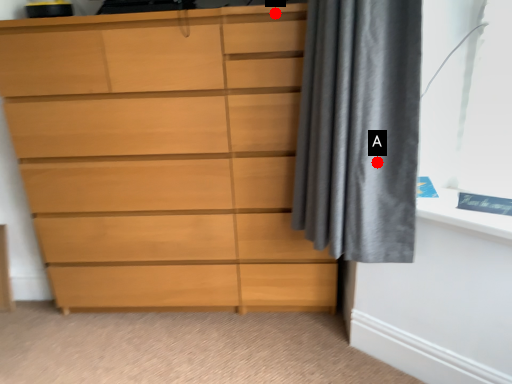
Question: Two points are circled on the image, labeled by A and B beside each circle. Among these points, which one is nearest to the camera?

Choices:
 (A) A is closer
 (B) B is closer

Answer: (A)